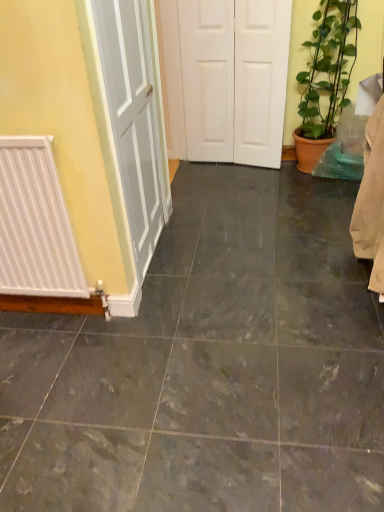
Locate an element on the screen. The width and height of the screenshot is (384, 512). vacant space situated above marble tile at center (from a real-world perspective) is located at coordinates (220, 273).